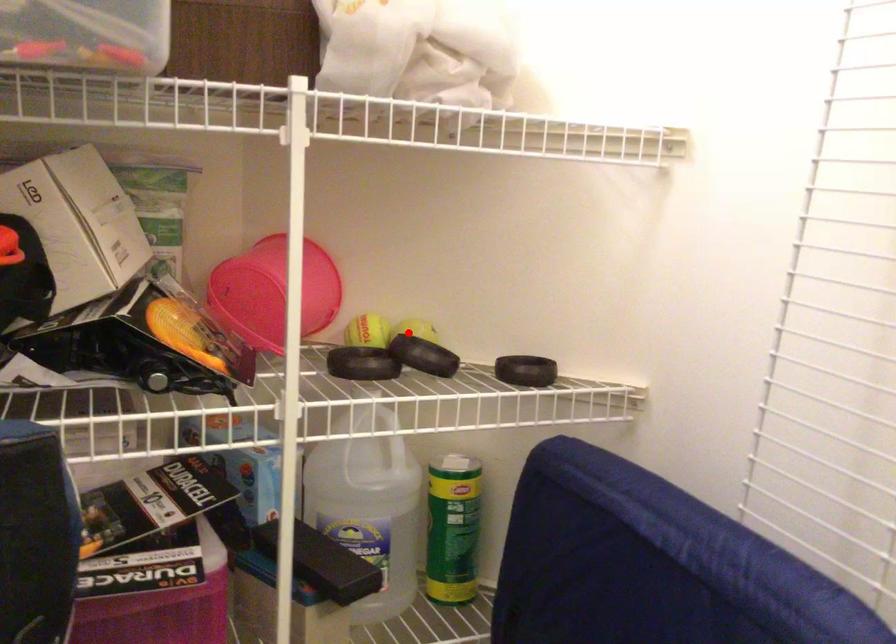
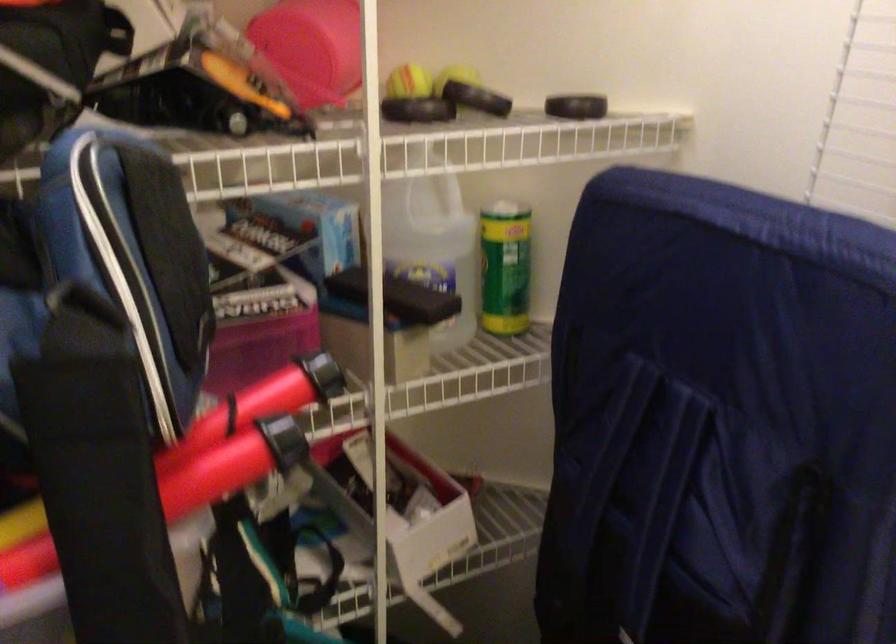
Find the pixel in the second image that matches the highlighted location in the first image.

(457, 76)